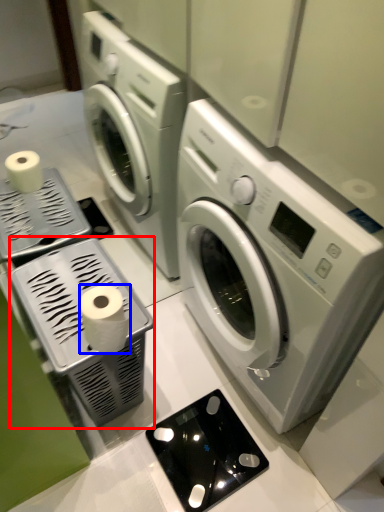
Question: Which object appears closest to the camera in this image, appliance (highlighted by a red box) or toilet paper (highlighted by a blue box)?

Choices:
 (A) appliance
 (B) toilet paper

Answer: (B)